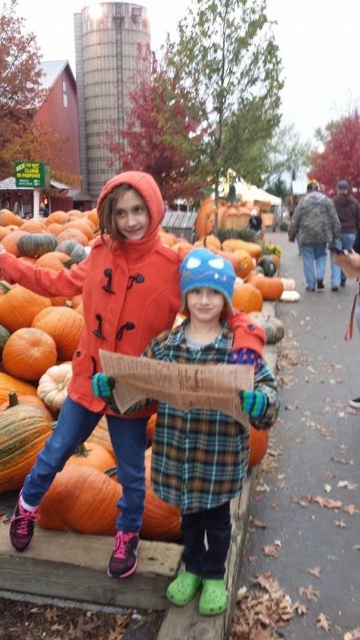
Question: Is matte orange coat at center below plaid fabric coat at center?

Choices:
 (A) yes
 (B) no

Answer: (B)

Question: Which of the following is the farthest from the observer?

Choices:
 (A) (195, 451)
 (B) (106, 221)

Answer: (B)

Question: Does matte orange coat at center appear on the right side of plaid fabric coat at center?

Choices:
 (A) no
 (B) yes

Answer: (A)

Question: Can you confirm if matte orange coat at center is positioned to the right of plaid fabric coat at center?

Choices:
 (A) no
 (B) yes

Answer: (A)

Question: Among these points, which one is nearest to the camera?

Choices:
 (A) (30, 536)
 (B) (192, 435)

Answer: (B)